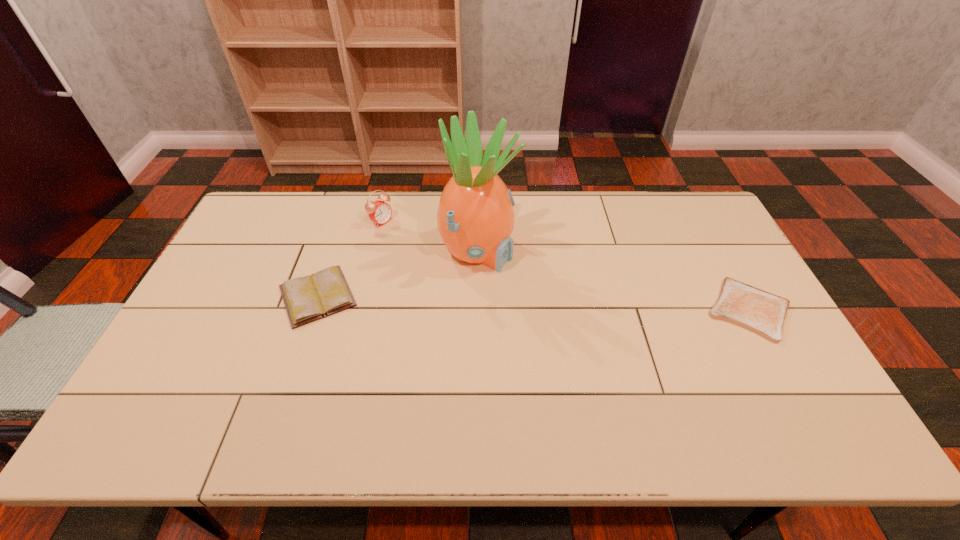
At what (x,y) coordinates should I click in order to perform the action: click on free space located 0.300m on the clock face of the alarm clock. Please return your answer as a coordinate pair (x, y). The image size is (960, 540). Looking at the image, I should click on (454, 267).

Locate an element on the screen. The image size is (960, 540). free space located at the entrance of the third object from left to right is located at coordinates (627, 322).

In order to click on vacant space located 0.180m at the entrance of the third object from left to right in this screenshot , I will do `click(562, 291)`.

Where is `vacant region located at the entrance of the third object from left to right`? The height and width of the screenshot is (540, 960). vacant region located at the entrance of the third object from left to right is located at coordinates (631, 323).

Locate an element on the screen. The width and height of the screenshot is (960, 540). alarm clock located in the far edge section of the desktop is located at coordinates (380, 212).

You are a GUI agent. You are given a task and a screenshot of the screen. Output one action in this format:
    pyautogui.click(x=<x>, y=<y>)
    Task: Click on the pineapple that is at the far edge
    The height and width of the screenshot is (540, 960).
    Given the screenshot: What is the action you would take?
    pyautogui.click(x=475, y=218)

You are a GUI agent. You are given a task and a screenshot of the screen. Output one action in this format:
    pyautogui.click(x=<x>, y=<y>)
    Task: Click on the object that is at the right edge
    The height and width of the screenshot is (540, 960).
    Given the screenshot: What is the action you would take?
    pyautogui.click(x=761, y=312)

In order to click on vacant position at the far edge of the desktop in this screenshot , I will do `click(542, 200)`.

This screenshot has width=960, height=540. Identify the location of vacant area at the near edge of the desktop. (307, 379).

You are a GUI agent. You are given a task and a screenshot of the screen. Output one action in this format:
    pyautogui.click(x=<x>, y=<y>)
    Task: Click on the vacant region at the left edge of the desktop
    
    Given the screenshot: What is the action you would take?
    pyautogui.click(x=259, y=251)